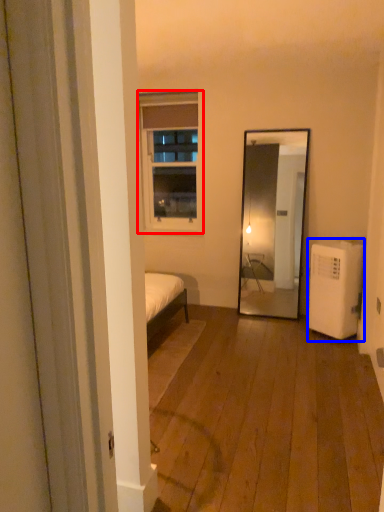
Question: Which object is further to the camera taking this photo, window (highlighted by a red box) or air conditioner (highlighted by a blue box)?

Choices:
 (A) window
 (B) air conditioner

Answer: (A)